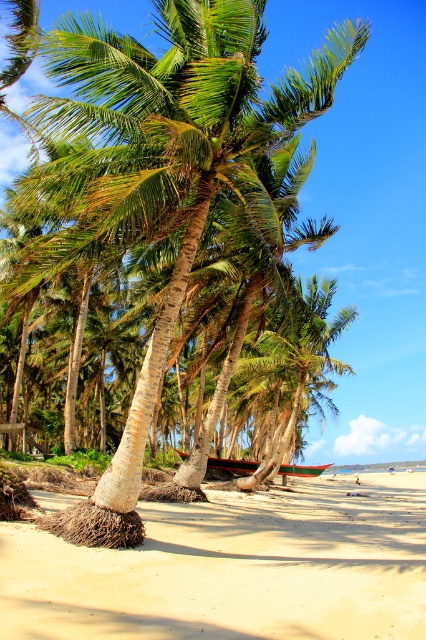
You are standing on the sandy beach at lower center and want to reach the green textured palm tree at center. Which direction should you move to get closer to the palm tree?

Since the sandy beach at lower center is in front of the green textured palm tree at center, you should move backward to reach the palm tree.

You are standing at the center of the sandy beach at lower center. If you walk straight ahead, will you reach the ocean first or the coconut palm trees first?

The coconut palm trees are closer to the sandy beach at lower center than the ocean, so you will reach the coconut palm trees first.